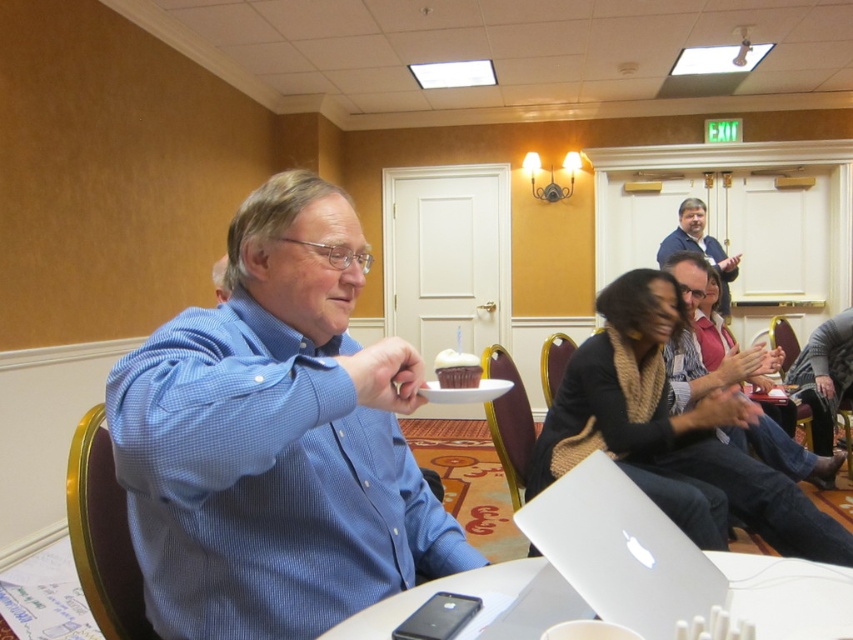
Between blue checkered shirt at center and smooth beige scarf at center, which one has more height?

Standing taller between the two is smooth beige scarf at center.

Can you confirm if blue checkered shirt at center is smaller than smooth beige scarf at center?

Correct, blue checkered shirt at center occupies less space than smooth beige scarf at center.

Is point (154, 420) in front of point (675, 380)?

Yes.

Locate an element on the screen. The image size is (853, 640). blue checkered shirt at center is located at coordinates (276, 440).

Between knitted scarf at center and smooth beige scarf at center, which one is positioned higher?

smooth beige scarf at center is above.

Is point (589, 445) more distant than point (729, 428)?

No, (589, 445) is closer to viewer.

Describe the element at coordinates (670, 429) in the screenshot. I see `knitted scarf at center` at that location.

Locate an element on the screen. knitted scarf at center is located at coordinates (670, 429).

Which of these two, blue checkered shirt at center or knitted scarf at center, stands taller?

Standing taller between the two is knitted scarf at center.

Is blue checkered shirt at center bigger than knitted scarf at center?

Actually, blue checkered shirt at center might be smaller than knitted scarf at center.

This screenshot has width=853, height=640. I want to click on blue checkered shirt at center, so click(276, 440).